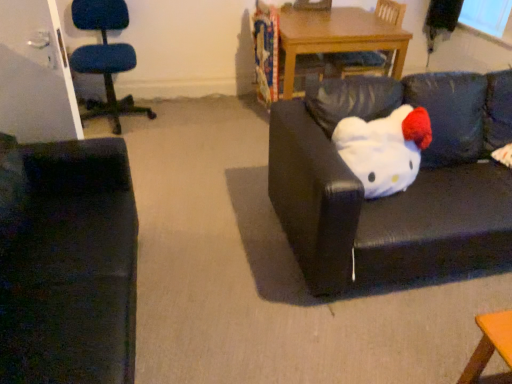
Question: Can you confirm if white plush toy at right is shorter than black leather couch at center, which ranks as the first studio couch in right-to-left order?

Choices:
 (A) no
 (B) yes

Answer: (B)

Question: Does white plush toy at right appear on the right side of black leather couch at center, which ranks as the first studio couch in right-to-left order?

Choices:
 (A) yes
 (B) no

Answer: (B)

Question: Considering the relative positions of white plush toy at right and black leather couch at center, which ranks as the first studio couch in right-to-left order, in the image provided, is white plush toy at right to the left of black leather couch at center, which ranks as the first studio couch in right-to-left order, from the viewer's perspective?

Choices:
 (A) no
 (B) yes

Answer: (B)

Question: Does white plush toy at right have a greater height compared to black leather couch at center, arranged as the 2th studio couch when viewed from the left?

Choices:
 (A) yes
 (B) no

Answer: (B)

Question: From the image's perspective, would you say white plush toy at right is positioned over black leather couch at center, arranged as the 2th studio couch when viewed from the left?

Choices:
 (A) no
 (B) yes

Answer: (B)

Question: Would you say velvet dark green couch at left, which appears as the 2th studio couch when viewed from the right, is to the left or to the right of white plush toy at right in the picture?

Choices:
 (A) right
 (B) left

Answer: (B)

Question: Considering the positions of velvet dark green couch at left, marked as the first studio couch in a left-to-right arrangement, and white plush toy at right in the image, is velvet dark green couch at left, marked as the first studio couch in a left-to-right arrangement, taller or shorter than white plush toy at right?

Choices:
 (A) short
 (B) tall

Answer: (B)

Question: From the image's perspective, is velvet dark green couch at left, marked as the first studio couch in a left-to-right arrangement, located above or below white plush toy at right?

Choices:
 (A) above
 (B) below

Answer: (B)

Question: Would you say velvet dark green couch at left, which appears as the 2th studio couch when viewed from the right, is inside or outside white plush toy at right?

Choices:
 (A) inside
 (B) outside

Answer: (B)

Question: From the image's perspective, is blue fabric chair at left, arranged as the 2th chair when viewed from the right, above or below black leather couch at center, arranged as the 2th studio couch when viewed from the left?

Choices:
 (A) below
 (B) above

Answer: (B)

Question: Does point (124, 99) appear closer or farther from the camera than point (429, 268)?

Choices:
 (A) farther
 (B) closer

Answer: (A)

Question: In terms of width, does blue fabric chair at left, arranged as the 2th chair when viewed from the right, look wider or thinner when compared to black leather couch at center, which ranks as the first studio couch in right-to-left order?

Choices:
 (A) wide
 (B) thin

Answer: (B)

Question: Is blue fabric chair at left, positioned as the first chair in left-to-right order, situated inside black leather couch at center, arranged as the 2th studio couch when viewed from the left, or outside?

Choices:
 (A) outside
 (B) inside

Answer: (A)

Question: Looking at their shapes, would you say wooden table at center is wider or thinner than blue fabric chair at left, positioned as the first chair in left-to-right order?

Choices:
 (A) thin
 (B) wide

Answer: (B)

Question: Looking at the image, does wooden table at center seem bigger or smaller compared to blue fabric chair at left, positioned as the first chair in left-to-right order?

Choices:
 (A) small
 (B) big

Answer: (B)